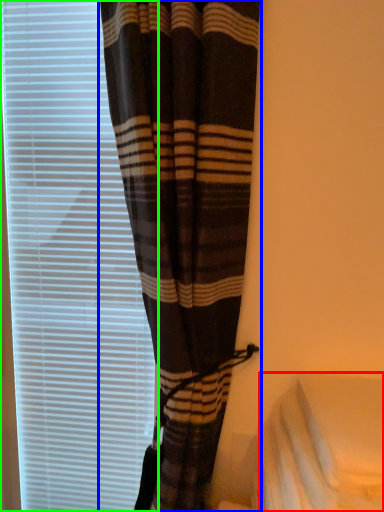
Question: Which object is the closest to the sheet (highlighted by a red box)? Choose among these: curtain (highlighted by a blue box) or window blind (highlighted by a green box).

Choices:
 (A) curtain
 (B) window blind

Answer: (A)